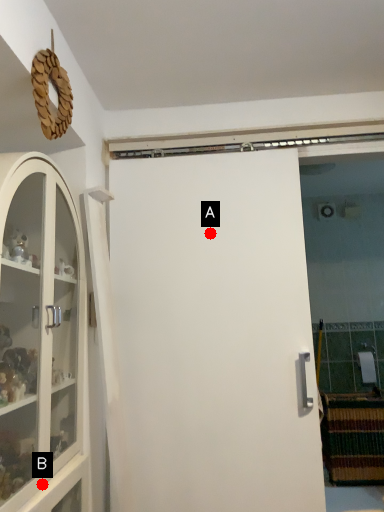
Question: Two points are circled on the image, labeled by A and B beside each circle. Which point is closer to the camera?

Choices:
 (A) A is closer
 (B) B is closer

Answer: (B)